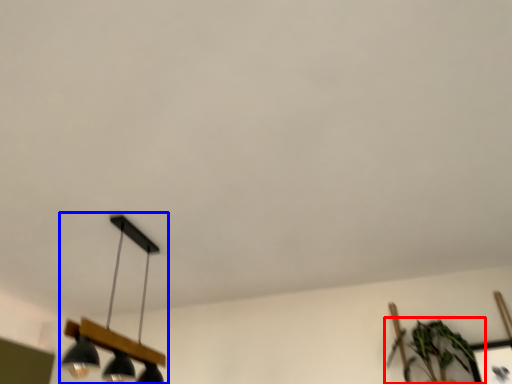
Question: Which point is further to the camera, houseplant (highlighted by a red box) or lamp (highlighted by a blue box)?

Choices:
 (A) houseplant
 (B) lamp

Answer: (A)